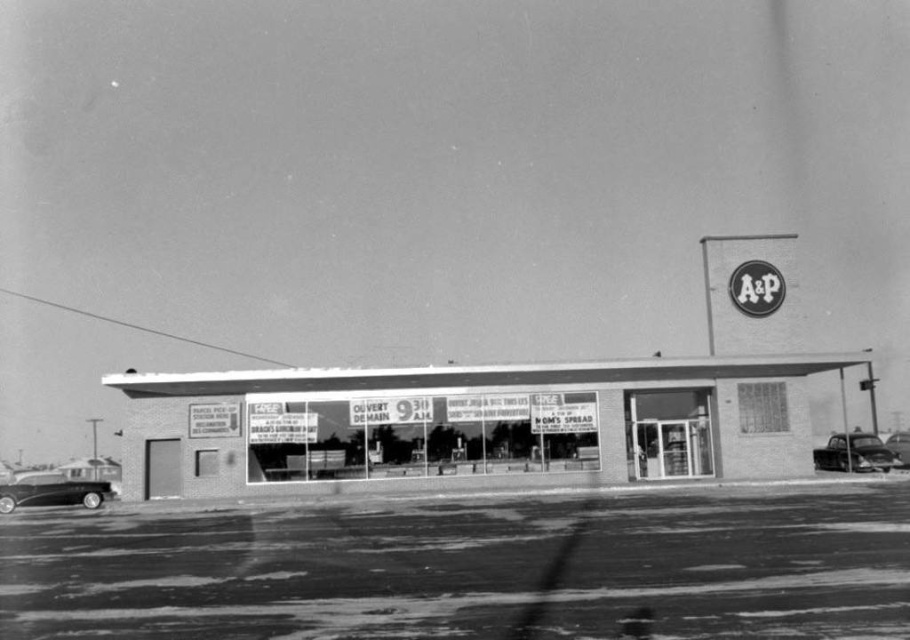
Does brick facade store at center have a lesser height compared to shiny black car at lower left?

In fact, brick facade store at center may be taller than shiny black car at lower left.

Identify the location of brick facade store at center. The height and width of the screenshot is (640, 910). (467, 426).

You are a GUI agent. You are given a task and a screenshot of the screen. Output one action in this format:
    pyautogui.click(x=<x>, y=<y>)
    Task: Click on the brick facade store at center
    The image size is (910, 640).
    Given the screenshot: What is the action you would take?
    pyautogui.click(x=467, y=426)

Which is in front, point (373, 477) or point (834, 456)?

Point (373, 477)

Between point (378, 438) and point (875, 444), which one is positioned behind?

Positioned behind is point (875, 444).

This screenshot has height=640, width=910. I want to click on brick facade store at center, so click(467, 426).

This screenshot has width=910, height=640. Identify the location of brick facade store at center. (467, 426).

Is shiny black car at lower right taller than shiny black car at right?

Correct, shiny black car at lower right is much taller as shiny black car at right.

The height and width of the screenshot is (640, 910). In order to click on shiny black car at lower right in this screenshot , I will do `click(855, 452)`.